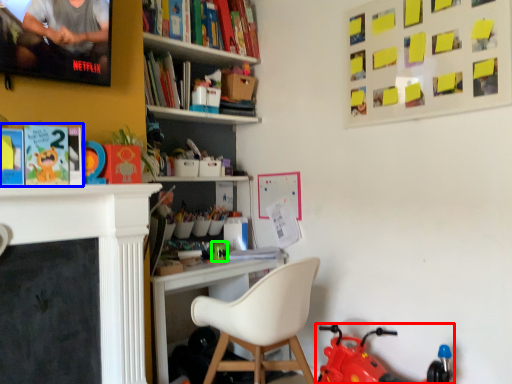
Question: Estimate the real-world distances between objects in this image. Which object is farther from toy (highlighted by a red box), book (highlighted by a blue box) or toy (highlighted by a green box)?

Choices:
 (A) book
 (B) toy

Answer: (A)